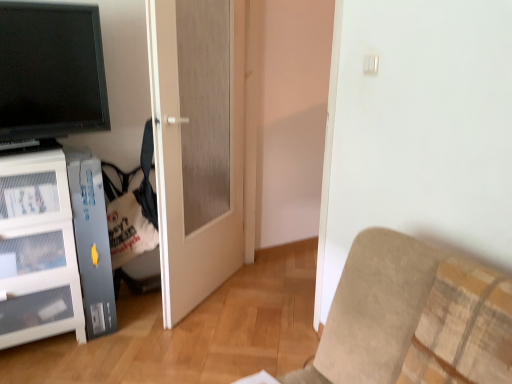
Question: Does matte white door at center have a lesser height compared to matte black tv at upper left?

Choices:
 (A) yes
 (B) no

Answer: (B)

Question: Are matte white door at center and matte black tv at upper left located far from each other?

Choices:
 (A) no
 (B) yes

Answer: (A)

Question: Is matte white door at center looking in the opposite direction of matte black tv at upper left?

Choices:
 (A) yes
 (B) no

Answer: (B)

Question: Considering the relative sizes of matte white door at center and matte black tv at upper left in the image provided, is matte white door at center taller than matte black tv at upper left?

Choices:
 (A) no
 (B) yes

Answer: (B)

Question: Is matte white door at center outside of matte black tv at upper left?

Choices:
 (A) yes
 (B) no

Answer: (A)

Question: Would you say matte white door at center is inside or outside beige fabric couch at lower right?

Choices:
 (A) outside
 (B) inside

Answer: (A)

Question: Visually, is matte white door at center positioned to the left or to the right of beige fabric couch at lower right?

Choices:
 (A) right
 (B) left

Answer: (B)

Question: In terms of width, does matte white door at center look wider or thinner when compared to beige fabric couch at lower right?

Choices:
 (A) wide
 (B) thin

Answer: (B)

Question: In terms of height, does matte white door at center look taller or shorter compared to beige fabric couch at lower right?

Choices:
 (A) tall
 (B) short

Answer: (A)

Question: Do you think matte white door at center is within matte black tv at upper left, or outside of it?

Choices:
 (A) outside
 (B) inside

Answer: (A)

Question: Based on their sizes in the image, would you say matte white door at center is bigger or smaller than matte black tv at upper left?

Choices:
 (A) big
 (B) small

Answer: (A)

Question: In the image, is matte white door at center positioned in front of or behind matte black tv at upper left?

Choices:
 (A) behind
 (B) front

Answer: (A)

Question: Visually, is matte white door at center positioned to the left or to the right of matte black tv at upper left?

Choices:
 (A) right
 (B) left

Answer: (A)

Question: Relative to matte white door at center, is matte black tv at upper left in front or behind?

Choices:
 (A) behind
 (B) front

Answer: (B)

Question: Looking at their shapes, would you say matte black tv at upper left is wider or thinner than matte white door at center?

Choices:
 (A) thin
 (B) wide

Answer: (A)